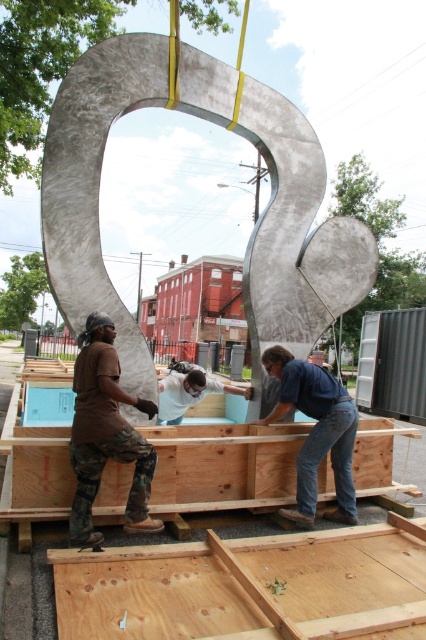
Consider the image. You are standing in front of the sculpture and want to locate the worker wearing brown camouflage pants at lower left. According to the coordinates provided, where exactly would you look?

The brown camouflage pants at lower left can be found at point (106,435).

You are a photographer trying to capture the workers assembling the sculpture. You notice the brown camouflage pants at lower left and the white matte shirt at center. Which worker should you focus on if you want to photograph someone with a narrower silhouette?

The brown camouflage pants at lower left has a lesser width compared to the white matte shirt at center, so you should focus on the worker wearing the brown camouflage pants at lower left for a narrower silhouette.